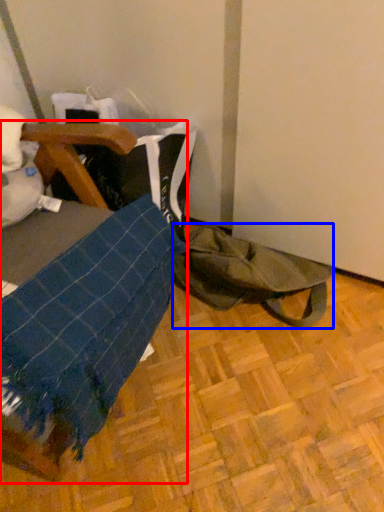
Question: Which object is further to the camera taking this photo, furniture (highlighted by a red box) or tote bag (highlighted by a blue box)?

Choices:
 (A) furniture
 (B) tote bag

Answer: (B)